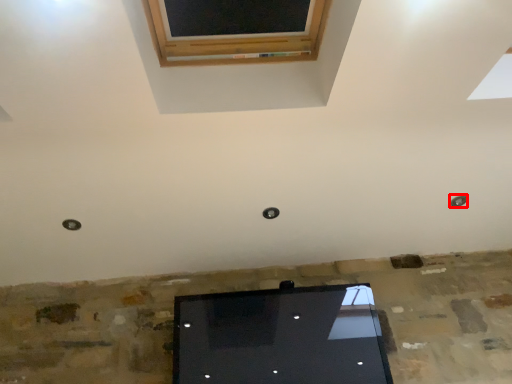
Question: From the image, what is the correct spatial relationship of hole (annotated by the red box) in relation to hole?

Choices:
 (A) right
 (B) left

Answer: (A)